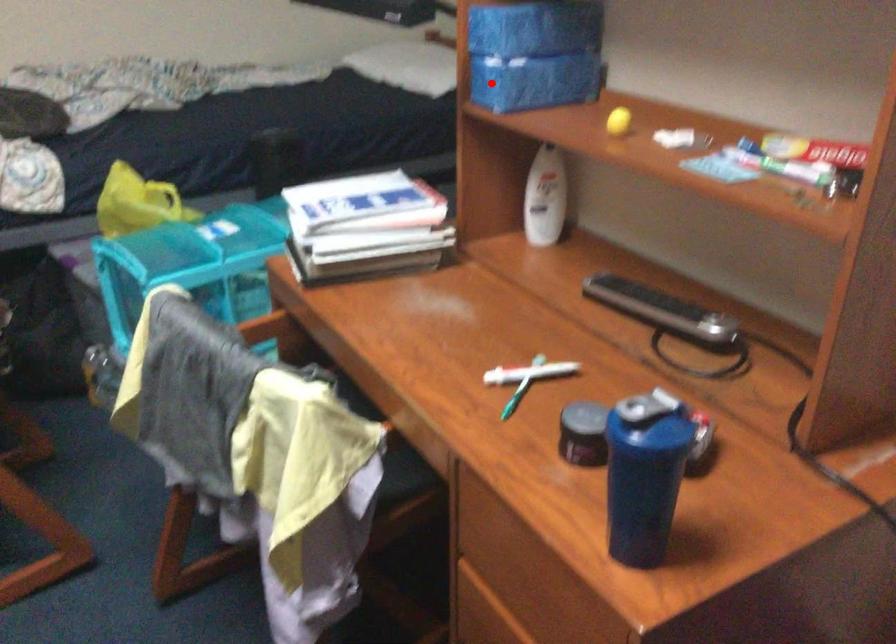
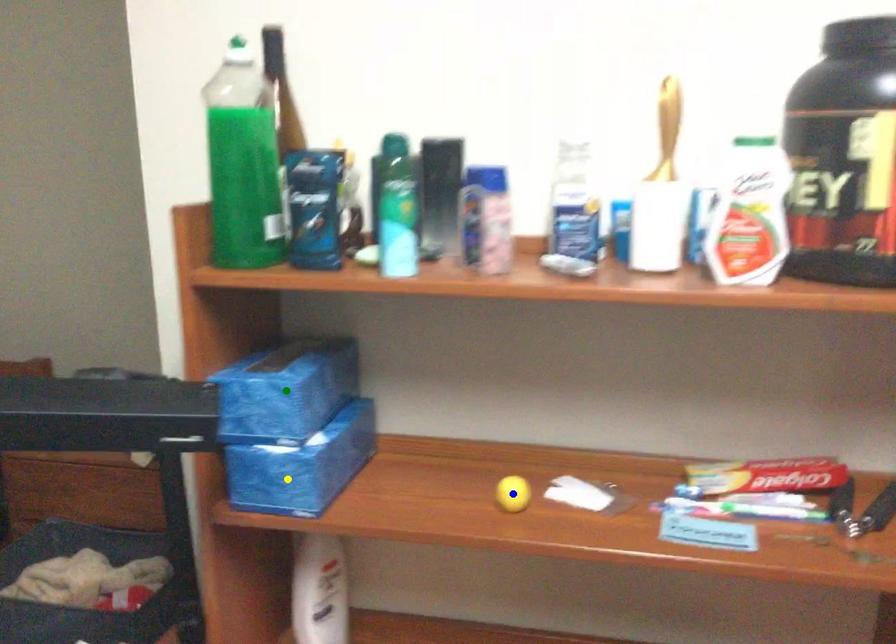
Question: I am providing you with two images of the same scene from different viewpoints. A red point is marked on the first image. You are given multiple points on the second image. Which point in image 2 represents the same 3d spot as the red point in image 1?

Choices:
 (A) green point
 (B) yellow point
 (C) blue point

Answer: (B)